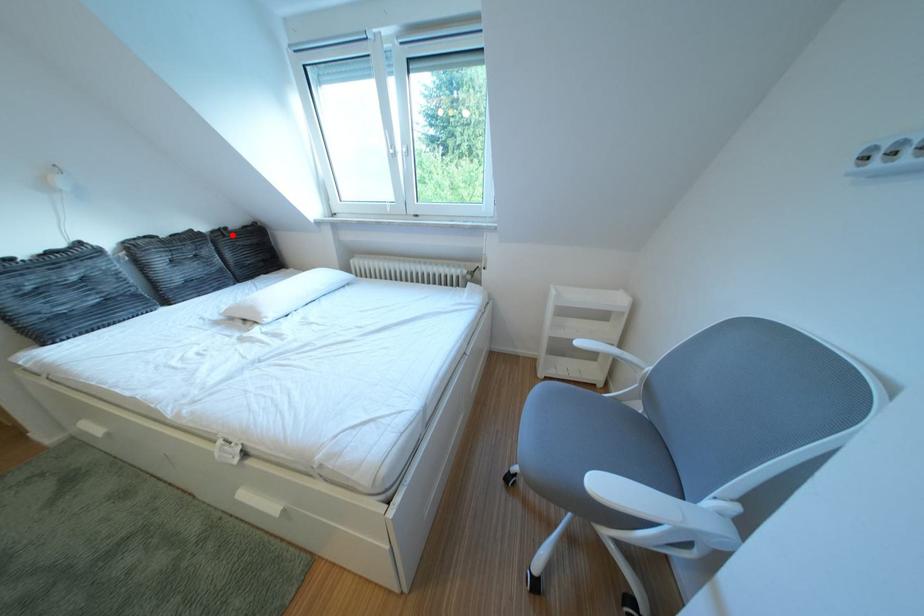
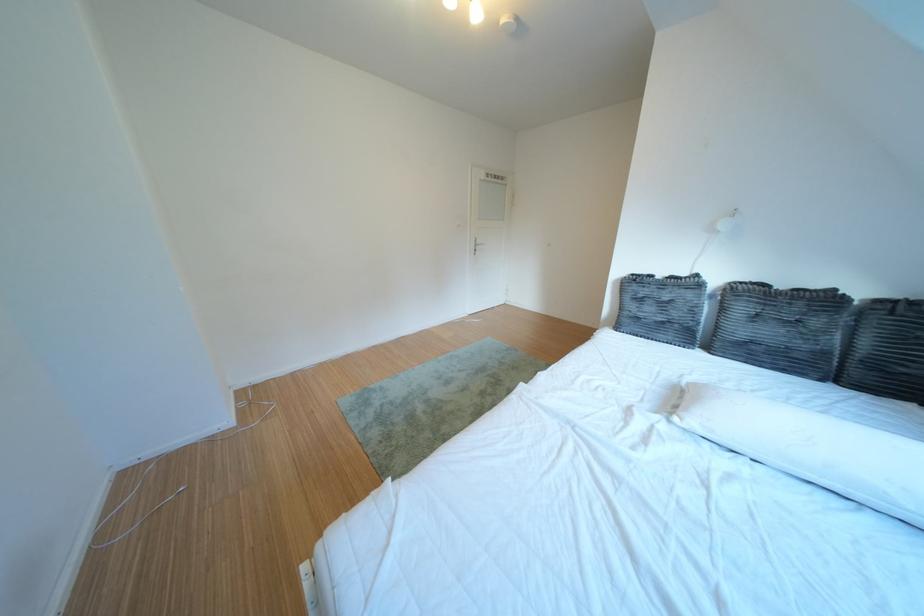
Question: I am providing you with two images of the same scene from different viewpoints. Image1 has a red point marked. In image2, the corresponding 3D location appears at what relative position? Reply with the corresponding letter.

Choices:
 (A) Closer
 (B) Farther

Answer: (B)